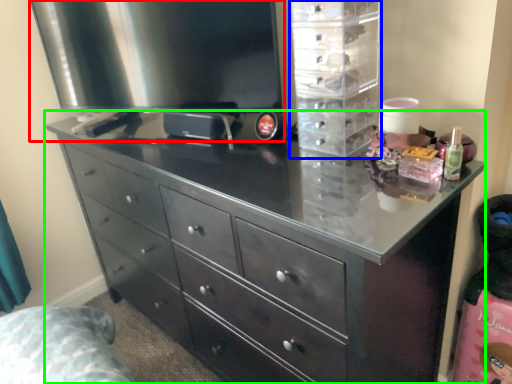
Question: Which object is the farthest from appliance (highlighted by a red box)? Choose among these: cabinet (highlighted by a blue box) or chest of drawers (highlighted by a green box).

Choices:
 (A) cabinet
 (B) chest of drawers

Answer: (B)